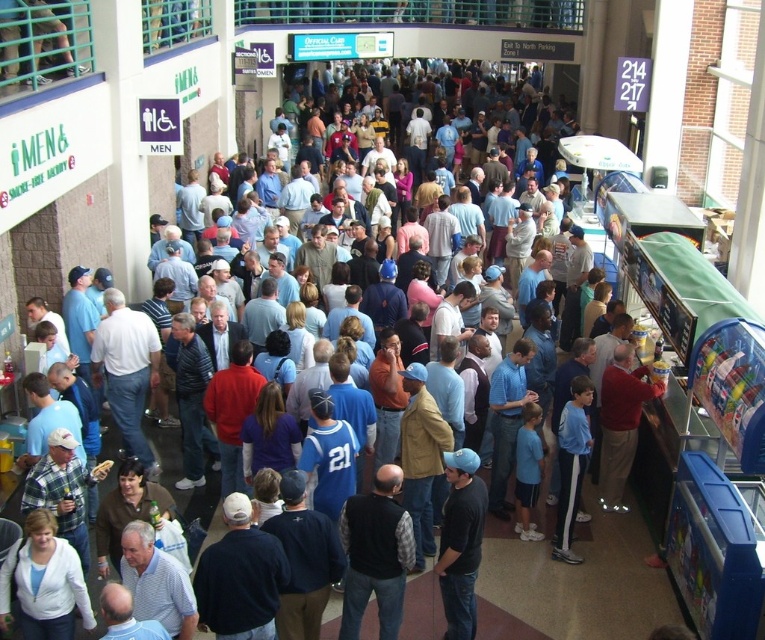
Question: Which point is closer to the camera taking this photo?

Choices:
 (A) (392, 529)
 (B) (477, 518)

Answer: (A)

Question: Observing the image, what is the correct spatial positioning of black vest at center in reference to black matte baseball cap at center?

Choices:
 (A) above
 (B) below

Answer: (B)

Question: Which point is farther to the camera?

Choices:
 (A) (376, 476)
 (B) (446, 609)

Answer: (B)

Question: Does black vest at center come behind black matte baseball cap at center?

Choices:
 (A) yes
 (B) no

Answer: (B)

Question: From the image, what is the correct spatial relationship of black vest at center in relation to black matte baseball cap at center?

Choices:
 (A) below
 (B) above

Answer: (A)

Question: Which point is closer to the camera?

Choices:
 (A) (448, 534)
 (B) (360, 612)

Answer: (A)